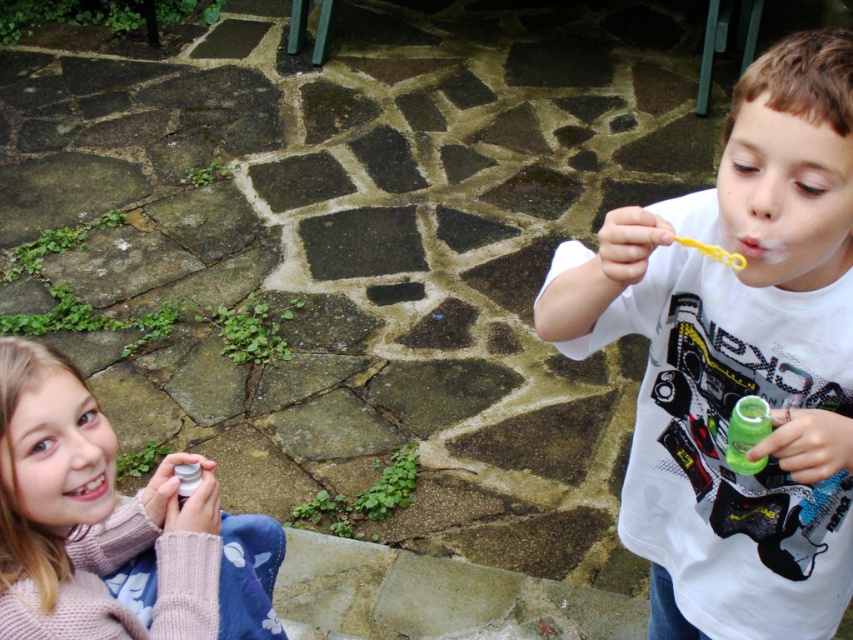
You are a photographer trying to capture both the green translucent bottle at right and the white glossy teeth at lower left in a single shot. Which object should you focus on first to ensure both are in focus?

You should focus on the green translucent bottle at right first because it is closer to you than the white glossy teeth at lower left, so adjusting focus starting from the closer object ensures both will be in focus.

You are a child trying to blow bubbles using the green translucent bottle at right and the white glossy teeth at lower left. Which object is wider?

The green translucent bottle at right is wider than the white glossy teeth at lower left.